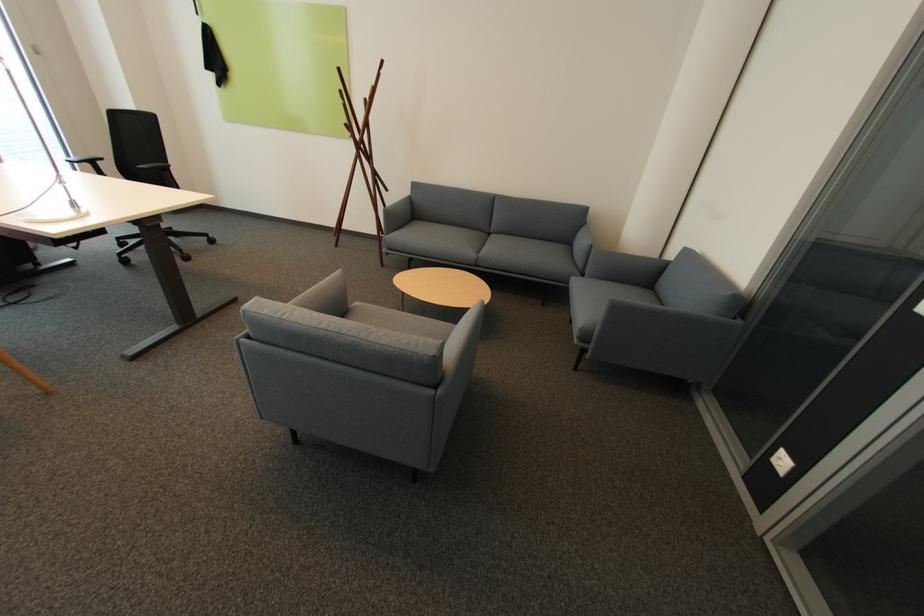
Locate an element on the screen. grey sofa sitting surface is located at coordinates (483, 249).